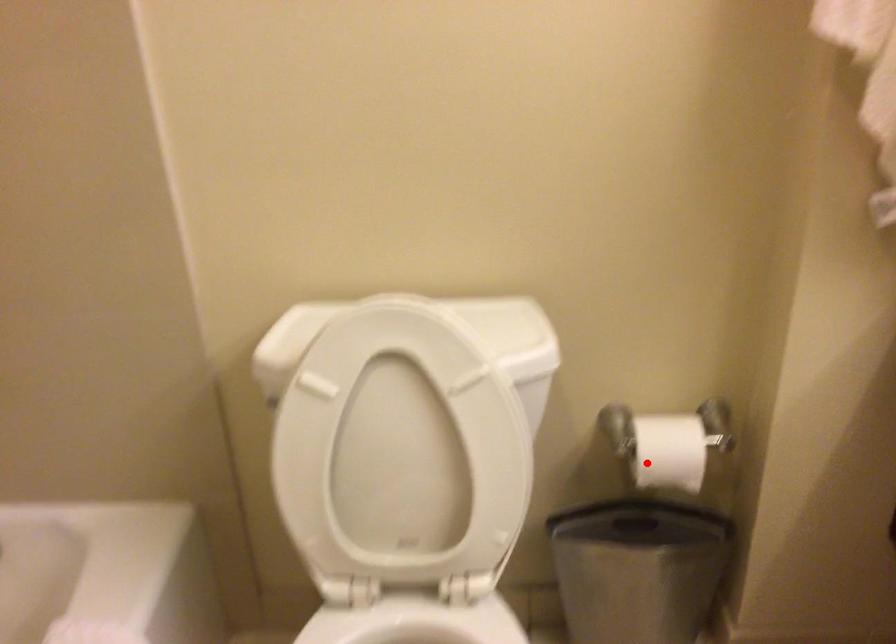
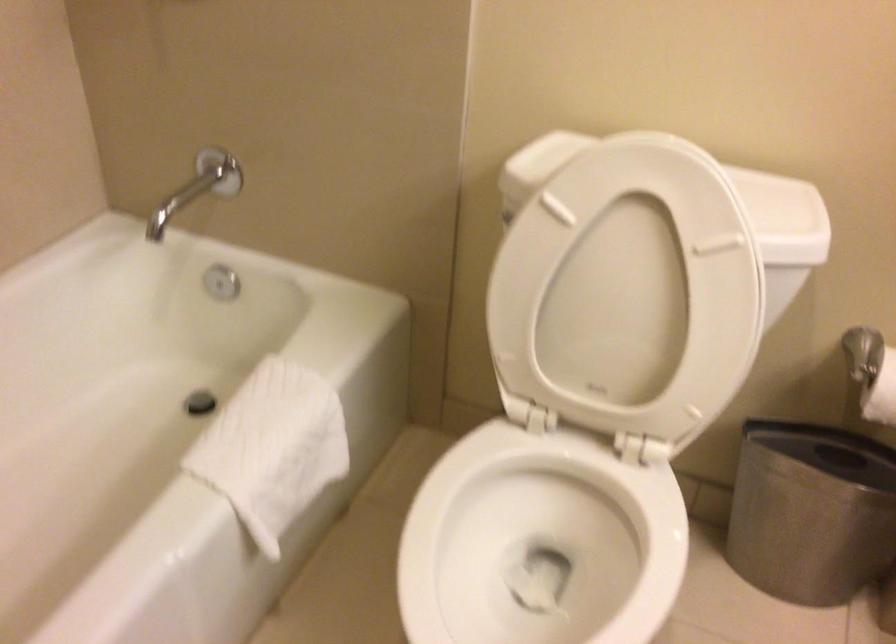
Where in the second image is the point corresponding to the highlighted location from the first image?

(881, 393)